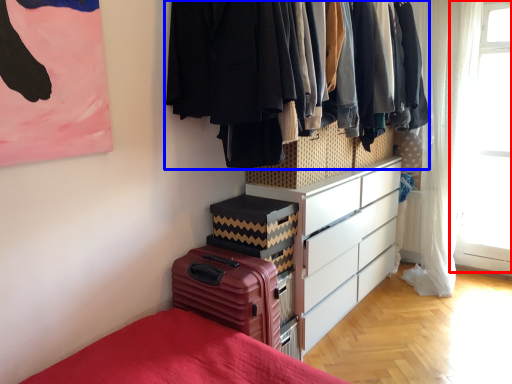
Question: Which object is further to the camera taking this photo, window screen (highlighted by a red box) or closet (highlighted by a blue box)?

Choices:
 (A) window screen
 (B) closet

Answer: (A)